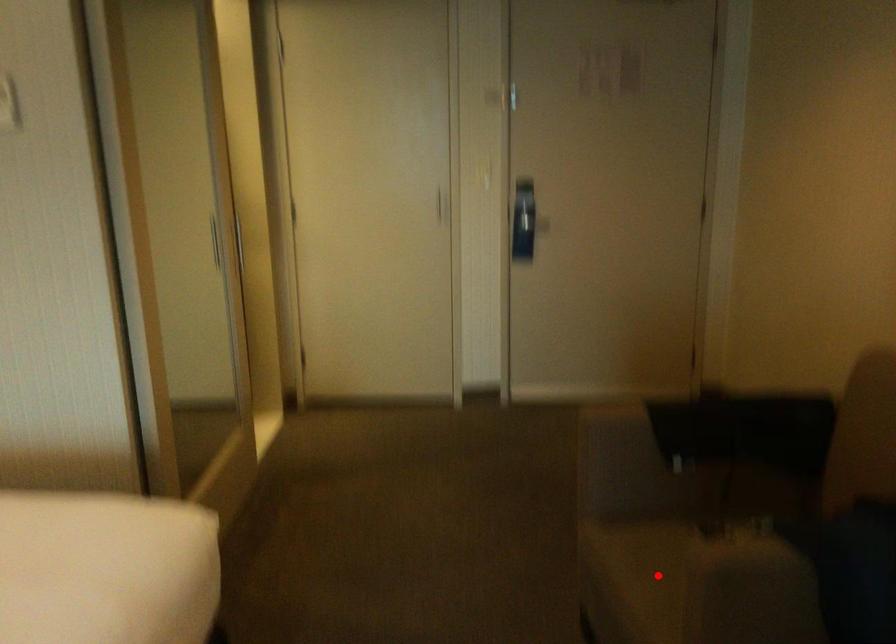
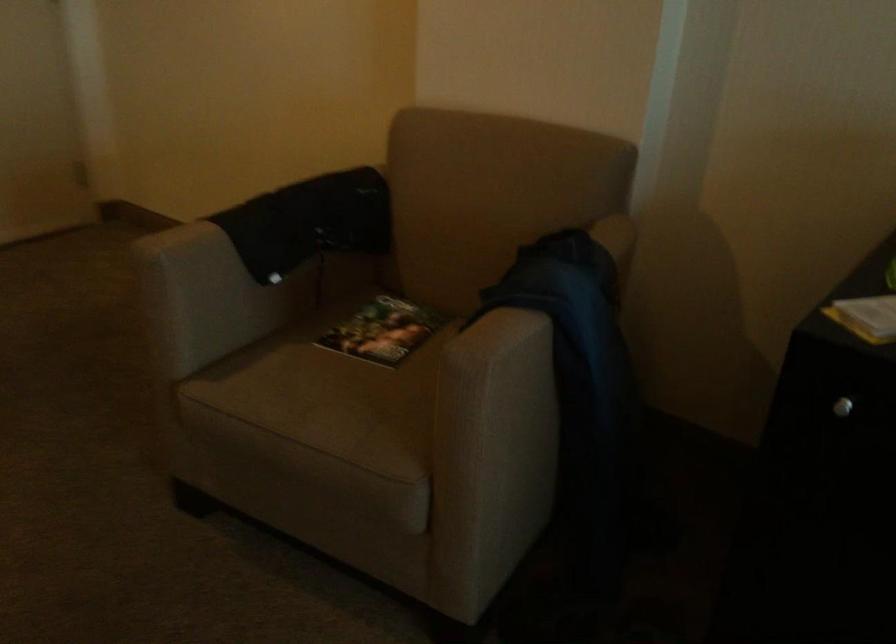
In the second image, find the point that corresponds to the highlighted location in the first image.

(330, 404)